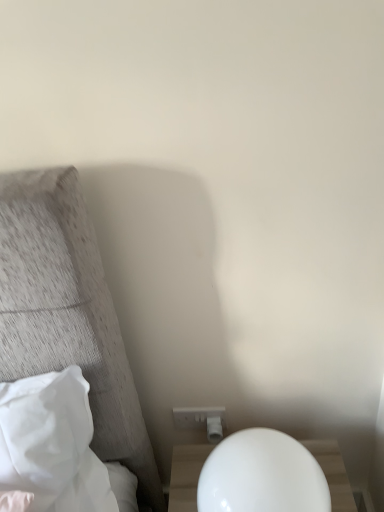
Question: Is white soft pillow at left inside or outside of white glossy nightstand at lower right?

Choices:
 (A) outside
 (B) inside

Answer: (A)

Question: Is white soft pillow at left wider or thinner than white glossy nightstand at lower right?

Choices:
 (A) wide
 (B) thin

Answer: (B)

Question: Estimate the real-world distances between objects in this image. Which object is farther from the white glossy nightstand at lower right?

Choices:
 (A) white plastic electric outlet at lower center
 (B) white soft pillow at left

Answer: (B)

Question: Based on their relative distances, which object is farther from the white soft pillow at left?

Choices:
 (A) white glossy nightstand at lower right
 (B) white plastic electric outlet at lower center

Answer: (B)